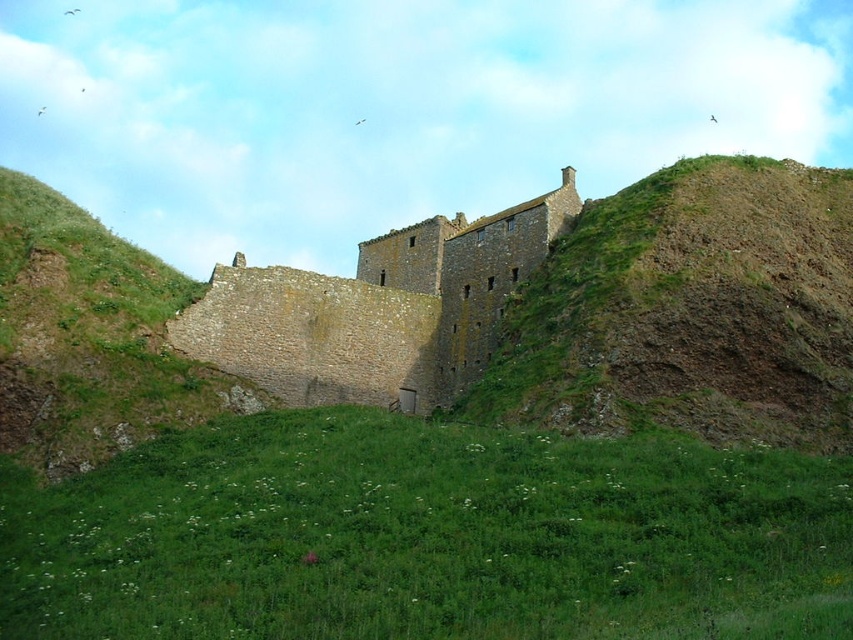
You are standing at the base of the hill looking towards the historic stone building. There are two points marked on the image. The first point is at coordinates point (227, 490) and the second point is at point (392, 246). From your vantage point, which point is closer to you?

Point (227, 490) is in front of point (392, 246), so it is closer to you.

You are a hiker standing at the base of the hill near the brown stone castle at center. You want to reach the summit of the brown rocky hillside at upper right. Based on the scene, which path would require less climbing effort?

The brown rocky hillside at upper right is much taller than the brown stone castle at center, so reaching the summit of the brown rocky hillside at upper right would require more climbing effort. Therefore, the path to the brown stone castle at center requires less climbing effort.

You are a landscape architect planning to redesign the area around the brown stone castle at center. Given that the green grassy field at center takes up less space than the castle, what would you suggest to balance the open space?

Since the green grassy field at center occupies less space than the brown stone castle at center, expanding the green grassy field at center could help balance the open space around the castle.